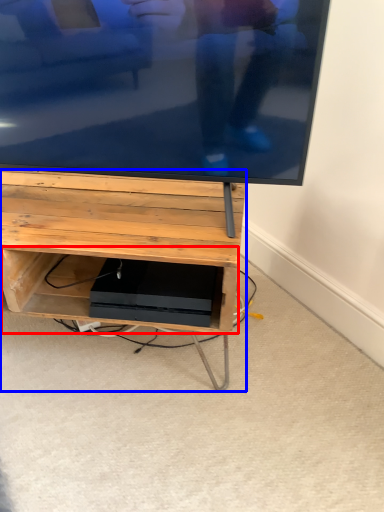
Question: Which object appears farthest to the camera in this image, shelf (highlighted by a red box) or furniture (highlighted by a blue box)?

Choices:
 (A) shelf
 (B) furniture

Answer: (A)